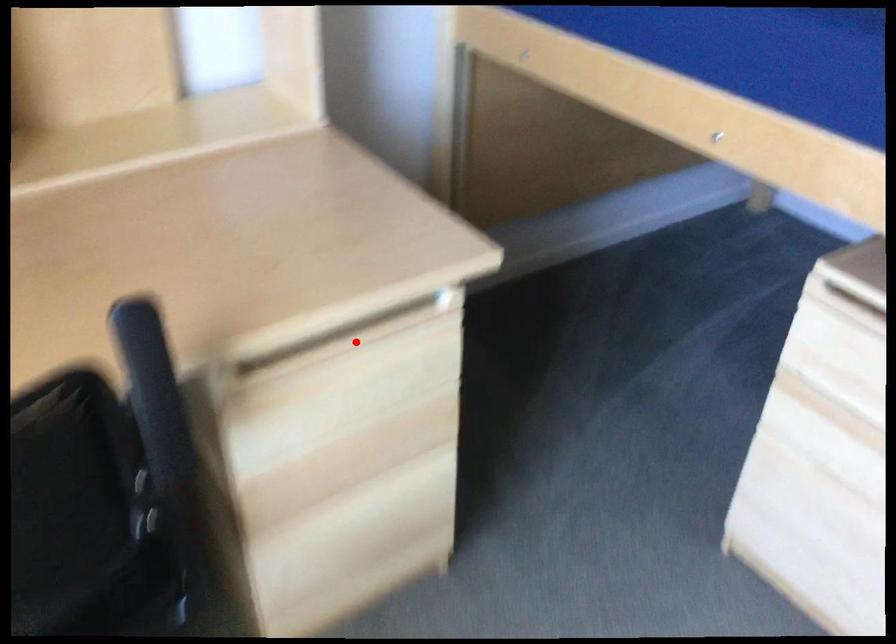
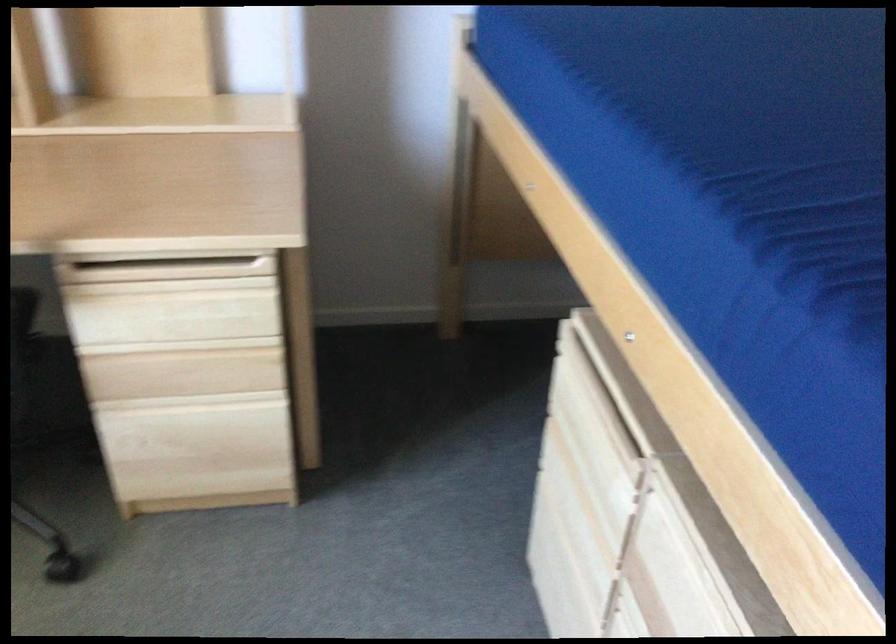
Question: I am providing you with two images of the same scene from different viewpoints. Given a red point in image1, look at the same physical point in image2. Is it:

Choices:
 (A) Closer to the viewpoint
 (B) Farther from the viewpoint

Answer: (B)